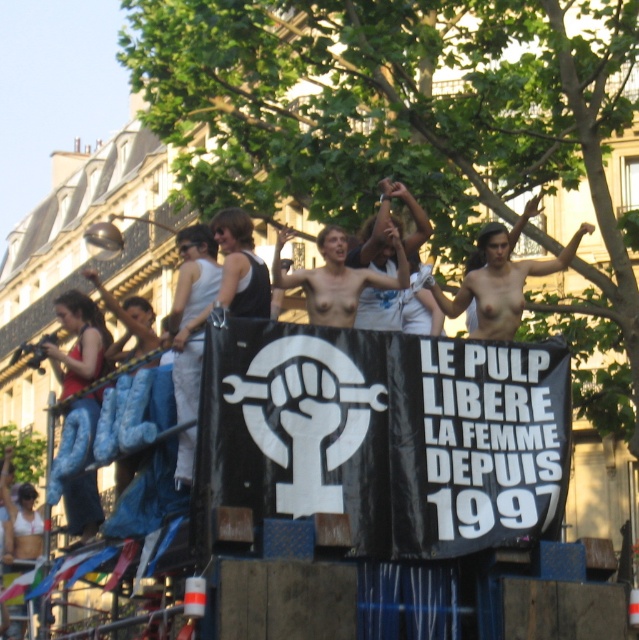
Can you confirm if skinny white torso at center is wider than nude torso at center?

Yes.

At what (x,y) coordinates should I click in order to perform the action: click on skinny white torso at center. Please return your answer as a coordinate pair (x, y). Looking at the image, I should click on click(502, 280).

Measure the distance between point (544,269) and camera.

55.34 meters

This screenshot has height=640, width=639. What are the coordinates of `skinny white torso at center` in the screenshot? It's located at (502, 280).

Is black fabric banner at center taller than skinny white torso at center?

Yes, black fabric banner at center is taller than skinny white torso at center.

Which is above, black fabric banner at center or skinny white torso at center?

Positioned higher is skinny white torso at center.

Is point (544, 365) less distant than point (520, 264)?

Yes, it is.

The image size is (639, 640). I want to click on black fabric banner at center, so 378,438.

Based on the photo, is black fabric banner at center taller than nude torso at center?

Correct, black fabric banner at center is much taller as nude torso at center.

Is point (373, 346) farther from viewer compared to point (399, 257)?

No, (373, 346) is closer to viewer.

Find the location of `black fabric banner at center`. black fabric banner at center is located at coordinates (378, 438).